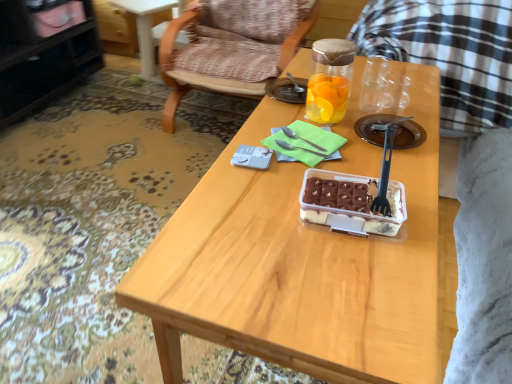
You are a GUI agent. You are given a task and a screenshot of the screen. Output one action in this format:
    pyautogui.click(x=<x>, y=<y>)
    Task: Click on the free space above wooden table at center (from a real-world perspective)
    Image resolution: width=512 pixels, height=384 pixels.
    Given the screenshot: What is the action you would take?
    pyautogui.click(x=324, y=166)